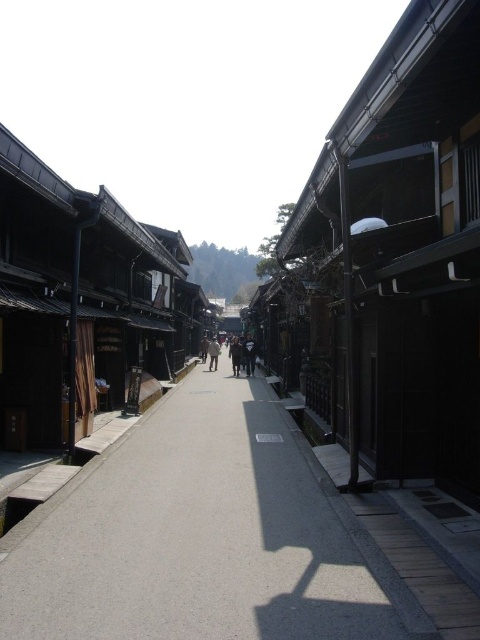
Can you confirm if dark blue jeans at center is shorter than light brown wooden person at center?

No.

Is dark blue jeans at center positioned behind light brown wooden person at center?

No, it is in front of light brown wooden person at center.

The width and height of the screenshot is (480, 640). I want to click on dark blue jeans at center, so click(236, 355).

Where is `dark blue jeans at center`? This screenshot has width=480, height=640. dark blue jeans at center is located at coordinates (236, 355).

Does gray concrete pavement at center come in front of light brown wooden person at center?

Yes, it is.

Can you confirm if gray concrete pavement at center is positioned to the left of light brown wooden person at center?

In fact, gray concrete pavement at center is to the right of light brown wooden person at center.

Is point (269, 528) positioned behind point (216, 355)?

No, (269, 528) is in front of (216, 355).

Locate an element on the screen. The image size is (480, 640). gray concrete pavement at center is located at coordinates (202, 536).

Is dark gray fabric coat at center shorter than light brown wooden person at center?

No, dark gray fabric coat at center is not shorter than light brown wooden person at center.

Can you confirm if dark gray fabric coat at center is positioned to the left of light brown wooden person at center?

Incorrect, dark gray fabric coat at center is not on the left side of light brown wooden person at center.

Does point (252, 358) come in front of point (216, 346)?

Yes, point (252, 358) is in front of point (216, 346).

Find the location of a particular element. The width and height of the screenshot is (480, 640). dark gray fabric coat at center is located at coordinates (249, 355).